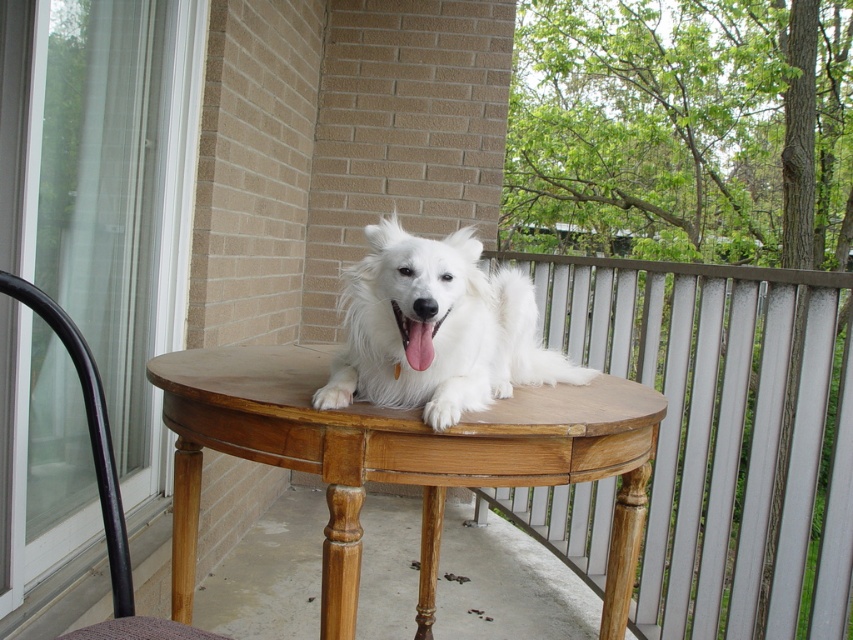
Does wooden table at center have a greater width compared to light brown wooden table at center?

No, wooden table at center is not wider than light brown wooden table at center.

Who is shorter, wooden table at center or light brown wooden table at center?

Standing shorter between the two is light brown wooden table at center.

Image resolution: width=853 pixels, height=640 pixels. Describe the element at coordinates (726, 435) in the screenshot. I see `wooden table at center` at that location.

Locate an element on the screen. wooden table at center is located at coordinates (726, 435).

Is wooden table at center wider than black wood chair at left?

Yes, wooden table at center is wider than black wood chair at left.

Does point (804, 269) come in front of point (117, 595)?

No, it is not.

Identify the location of wooden table at center. (726, 435).

Can you confirm if white fluffy dog at center is taller than black wood chair at left?

Incorrect, white fluffy dog at center's height is not larger of black wood chair at left's.

Does point (444, 339) lie in front of point (56, 332)?

No, it is not.

Which is behind, point (502, 320) or point (196, 634)?

Positioned behind is point (502, 320).

What are the coordinates of `white fluffy dog at center` in the screenshot? It's located at (436, 330).